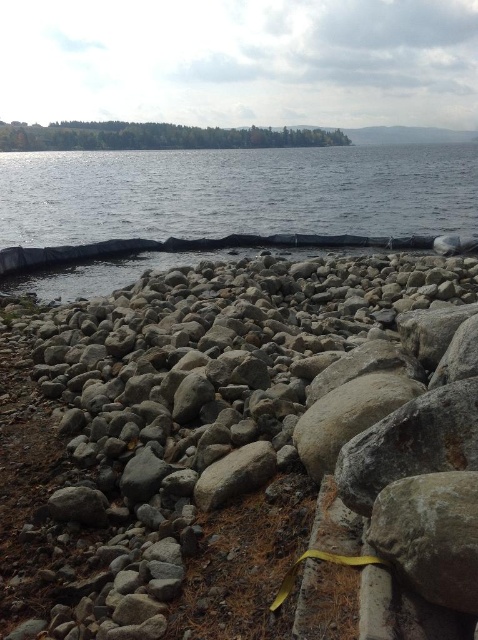
You are standing at the edge of the gray rock shoreline at lower left and want to reach the clear water at center. Which direction should you move to get to the water?

The gray rock shoreline at lower left is positioned on the right side of clear water at center, so to reach the clear water at center, you should move to the left.